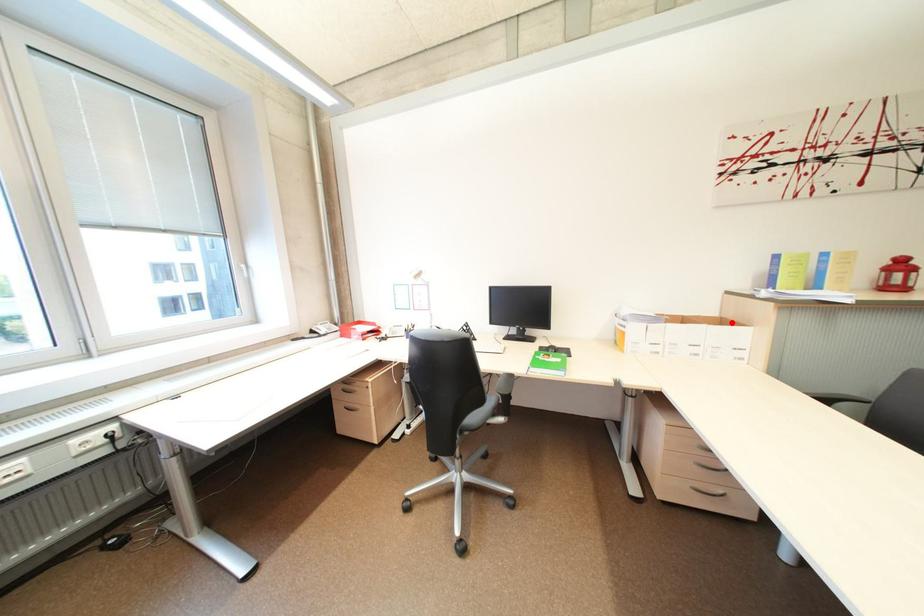
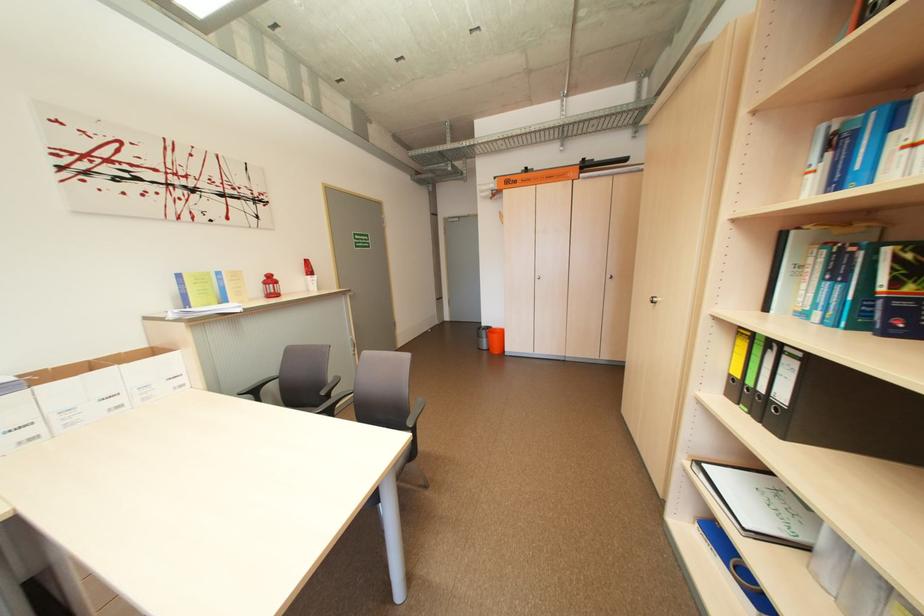
In the second image, find the point that corresponds to the highlighted location in the first image.

(163, 353)